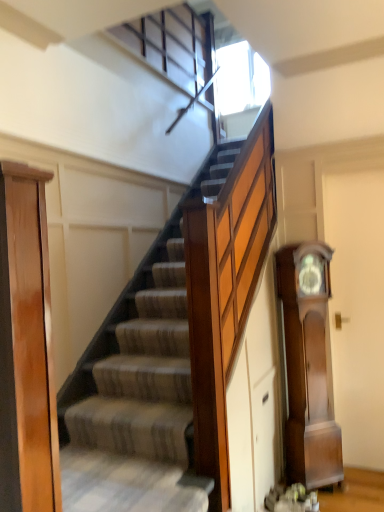
Question: Considering their positions, is light brown wood door at left located in front of or behind polished wood grandfather clock at right?

Choices:
 (A) front
 (B) behind

Answer: (A)

Question: From their relative heights in the image, would you say light brown wood door at left is taller or shorter than polished wood grandfather clock at right?

Choices:
 (A) short
 (B) tall

Answer: (A)

Question: From a real-world perspective, is light brown wood door at left positioned above or below polished wood grandfather clock at right?

Choices:
 (A) below
 (B) above

Answer: (B)

Question: Looking at their shapes, would you say polished wood grandfather clock at right is wider or thinner than light brown wood door at left?

Choices:
 (A) thin
 (B) wide

Answer: (B)

Question: Would you say polished wood grandfather clock at right is inside or outside light brown wood door at left?

Choices:
 (A) inside
 (B) outside

Answer: (B)

Question: Does point (283, 301) appear closer or farther from the camera than point (48, 504)?

Choices:
 (A) farther
 (B) closer

Answer: (A)

Question: From the image's perspective, is polished wood grandfather clock at right positioned above or below light brown wood door at left?

Choices:
 (A) above
 (B) below

Answer: (B)